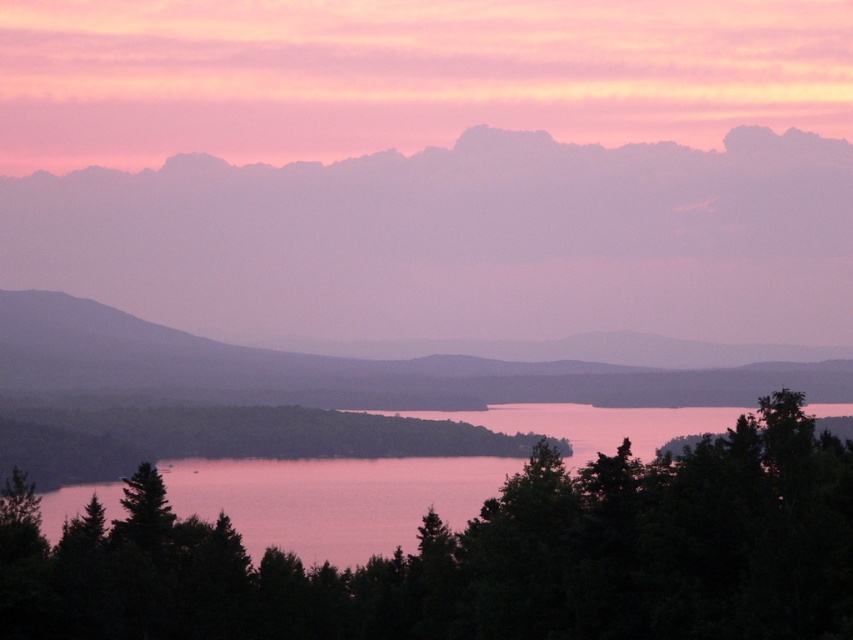
Consider the image. You are an artist trying to paint this landscape. You want to ensure the purple foggy cloud at upper center and the smooth purple mountain at left are positioned correctly in terms of depth. Which object should appear closer to the viewer in your painting?

The purple foggy cloud at upper center should appear closer to the viewer because it is further to the viewer than the smooth purple mountain at left.

You are standing in the serene landscape scene. There is a point marked at coordinates (459, 244). What object is located at that point?

The point at coordinates (459, 244) indicates a purple foggy cloud at upper center.

You are standing in the serene landscape scene and want to take a photo of the purple foggy cloud at upper center. Since you have a camera with a standard lens that can focus up to 500 meters, will you be able to capture the cloud clearly?

The purple foggy cloud at upper center is 584.62 meters away from the viewer. Since the camera can only focus up to 500 meters, it will not be able to capture the cloud clearly. You might need a telephoto lens for better focus.